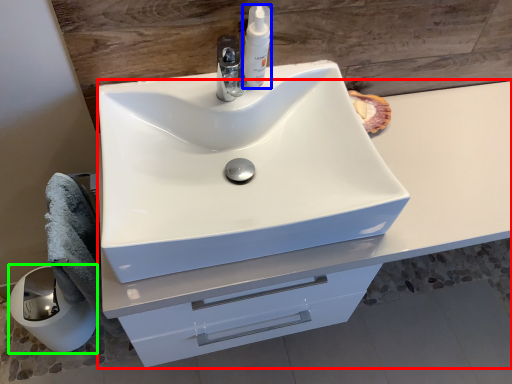
Question: Estimate the real-world distances between objects in this image. Which object is closer to bathroom cabinet (highlighted by a red box), soap dispenser (highlighted by a blue box) or paper towel (highlighted by a green box)?

Choices:
 (A) soap dispenser
 (B) paper towel

Answer: (A)